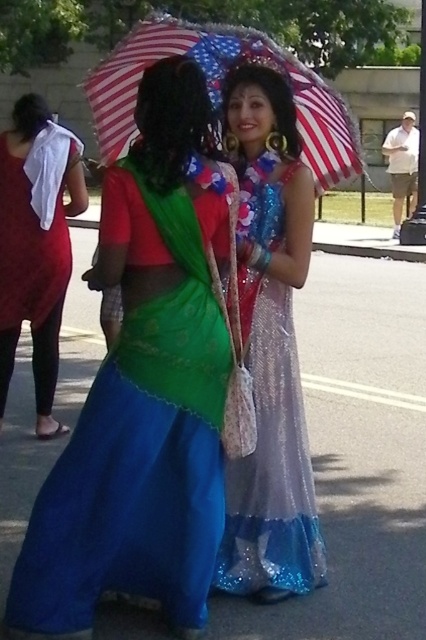
You are standing in front of the two individuals under the large umbrella. You notice the shiny green fabric at center. Where exactly is this fabric positioned relative to the other elements in the scene?

→ The shiny green fabric at center is located at point coordinates [143,390] in the scene.

You are a photographer setting up for a photoshoot and need to position a light source to the left of the shiny green fabric at center. Since the american flag fabric umbrella at upper center is in the way, can you place the light there without moving the umbrella?

The shiny green fabric at center is to the right of the american flag fabric umbrella at upper center, so placing the light to the left of the shiny green fabric at center would be possible as it is not blocked by the umbrella.

You are a photographer trying to capture both the sparkly silver dress at center and the matte red dress at left in a single frame. Given their sizes, which dress might you need to position closer to the camera to ensure both are visible clearly?

The sparkly silver dress at center occupies less space than the matte red dress at left, so positioning the sparkly silver dress at center closer to the camera would help balance their visibility in the frame.